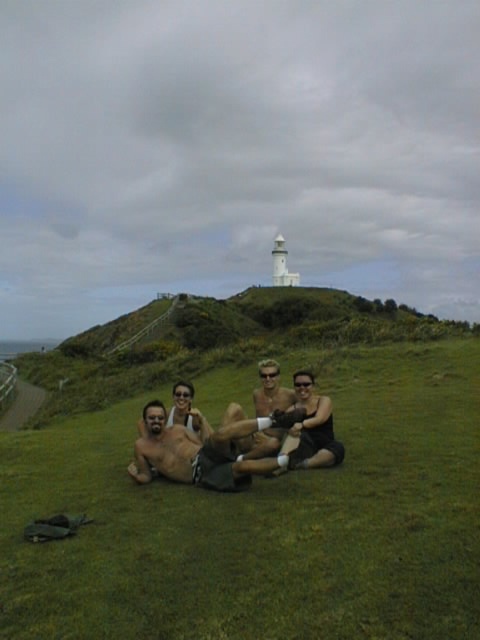
Does point (218, 330) come in front of point (316, 428)?

No, (218, 330) is further to viewer.

Which is below, green grassy hillside at upper center or black fabric shorts at center?

black fabric shorts at center is below.

Does point (386, 317) lie behind point (332, 424)?

Yes.

Where is `green grassy hillside at upper center`? green grassy hillside at upper center is located at coordinates (255, 320).

What do you see at coordinates (202, 451) in the screenshot? I see `shiny metallic shorts at center` at bounding box center [202, 451].

Between shiny metallic shorts at center and black fabric shorts at center, which one is positioned lower?

shiny metallic shorts at center is below.

Between point (152, 404) and point (328, 417), which one is positioned in front?

Point (152, 404) is in front.

Identify the location of shiny metallic shorts at center. The image size is (480, 640). (202, 451).

You are a GUI agent. You are given a task and a screenshot of the screen. Output one action in this format:
    pyautogui.click(x=<x>, y=<y>)
    Task: Click on the green grassy at center
    The width and height of the screenshot is (480, 640).
    Given the screenshot: What is the action you would take?
    (263, 520)

Is green grassy at center bigger than green grassy hillside at upper center?

No, green grassy at center is not bigger than green grassy hillside at upper center.

Who is more forward, (361, 448) or (266, 304)?

Point (361, 448)

This screenshot has height=640, width=480. Identify the location of green grassy at center. (263, 520).